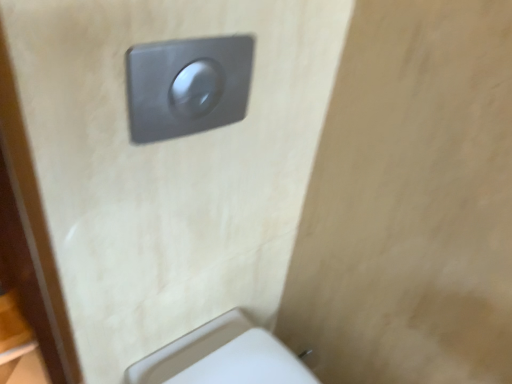
Question: In terms of height, does satin silver switch at upper center look taller or shorter compared to metallic gray flush button at upper center?

Choices:
 (A) tall
 (B) short

Answer: (B)

Question: Is satin silver switch at upper center bigger or smaller than metallic gray flush button at upper center?

Choices:
 (A) big
 (B) small

Answer: (B)

Question: Which is nearer to the metallic gray flush button at upper center?

Choices:
 (A) satin silver switch at upper center
 (B) white plastic toilet at lower right

Answer: (A)

Question: Which of these objects is positioned farthest from the white plastic toilet at lower right?

Choices:
 (A) metallic gray flush button at upper center
 (B) satin silver switch at upper center

Answer: (B)